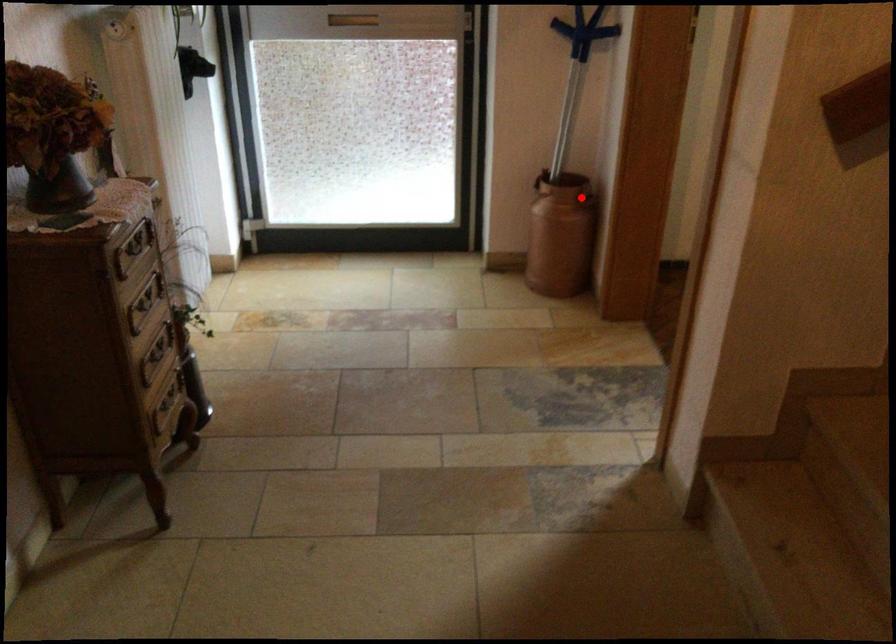
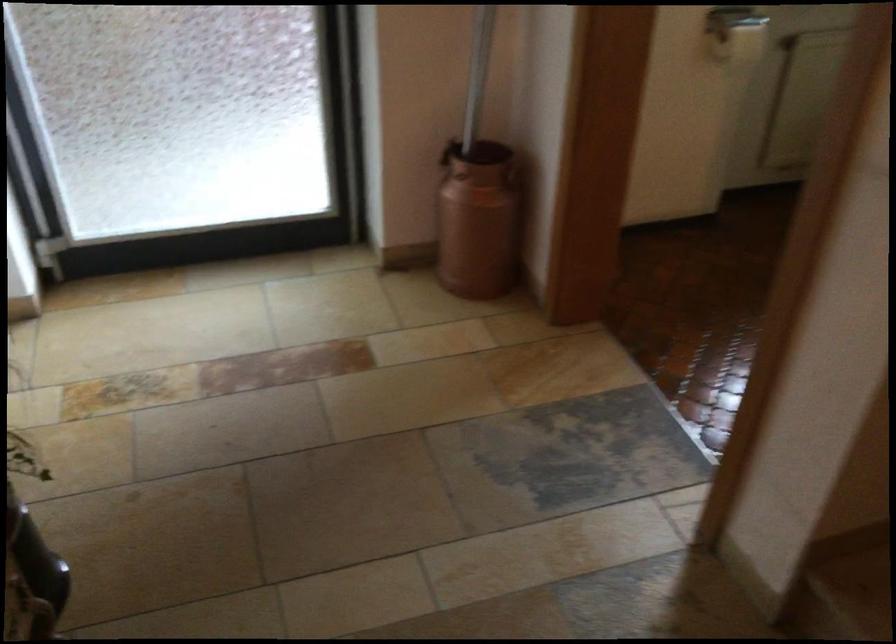
Question: I am providing you with two images of the same scene from different viewpoints. Image1 has a red point marked. In image2, the corresponding 3D location appears at what relative position? Reply with the corresponding letter.

Choices:
 (A) Closer
 (B) Farther

Answer: (A)